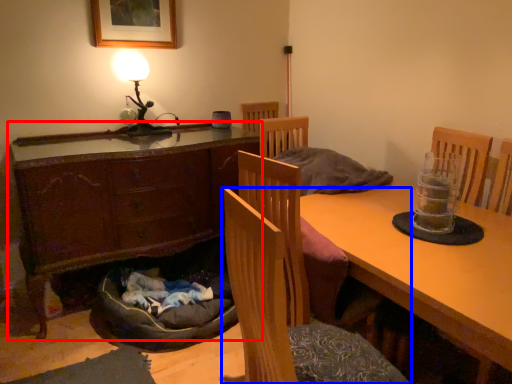
Question: Which of the following is the closest to the observer, cabinetry (highlighted by a red box) or chair (highlighted by a blue box)?

Choices:
 (A) cabinetry
 (B) chair

Answer: (B)